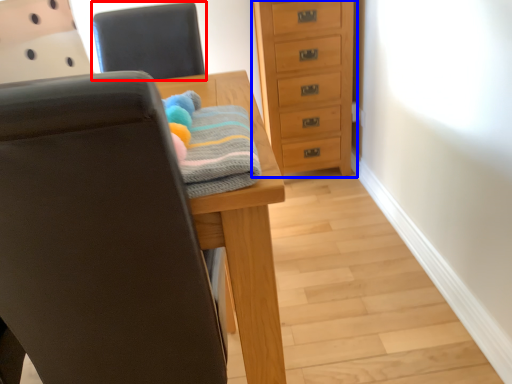
Question: Which object is further to the camera taking this photo, chair (highlighted by a red box) or chest of drawers (highlighted by a blue box)?

Choices:
 (A) chair
 (B) chest of drawers

Answer: (B)